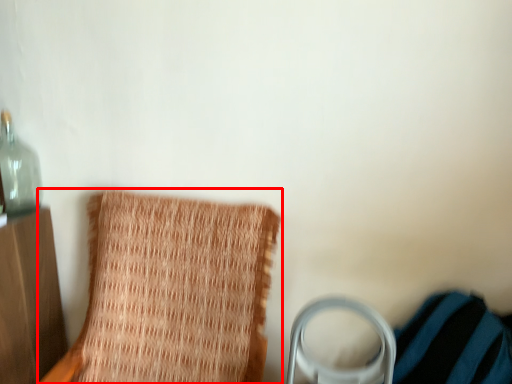
Question: From the image, what is the correct spatial relationship of furniture (annotated by the red box) in relation to bottle?

Choices:
 (A) left
 (B) right

Answer: (B)